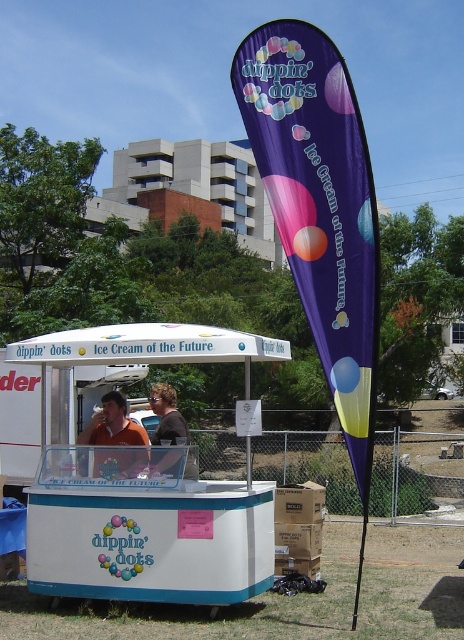
Measure the distance from orange t-shirt at center to brown shirt at center.

orange t-shirt at center and brown shirt at center are 17.02 inches apart from each other.

Does orange t-shirt at center have a greater width compared to brown shirt at center?

Correct, the width of orange t-shirt at center exceeds that of brown shirt at center.

Image resolution: width=464 pixels, height=640 pixels. In order to click on orange t-shirt at center in this screenshot , I will do `click(113, 424)`.

Which is below, white plastic food truck at center or brown shirt at center?

white plastic food truck at center is below.

Based on the photo, who is positioned more to the right, white plastic food truck at center or brown shirt at center?

brown shirt at center

Who is more forward, [242,362] or [168,387]?

Positioned in front is point [168,387].

In order to click on white plastic food truck at center in this screenshot , I will do `click(143, 484)`.

Between point (264, 36) and point (116, 419), which one is positioned behind?

The point (116, 419) is more distant.

Between purple fabric canopy at upper center and orange t-shirt at center, which one is positioned lower?

orange t-shirt at center is lower down.

Describe the element at coordinates (320, 205) in the screenshot. I see `purple fabric canopy at upper center` at that location.

Identify the location of purple fabric canopy at upper center. The image size is (464, 640). (320, 205).